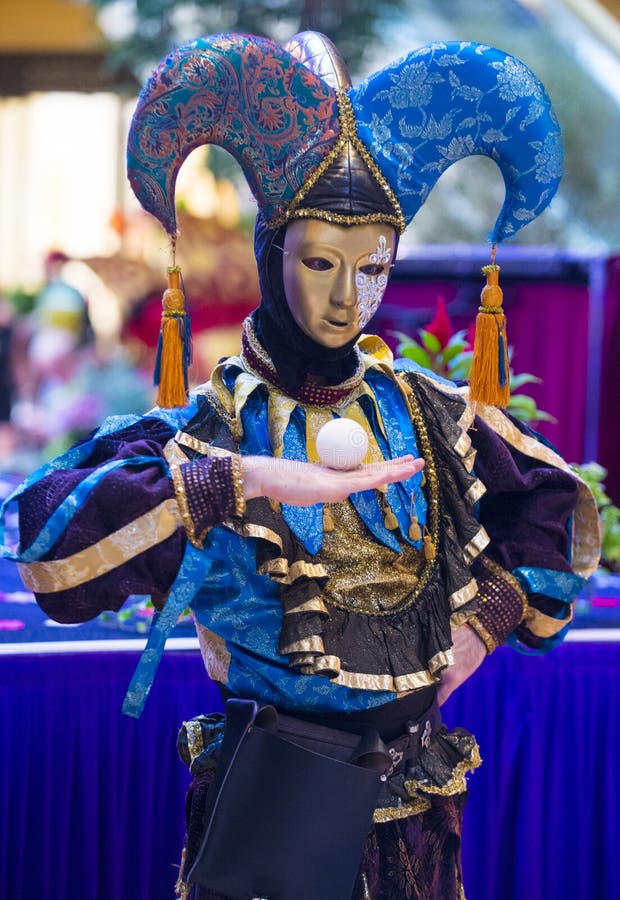
Identify the location of tassels. The width and height of the screenshot is (620, 900). (489, 355), (502, 364), (170, 355), (185, 364), (190, 339), (154, 373).